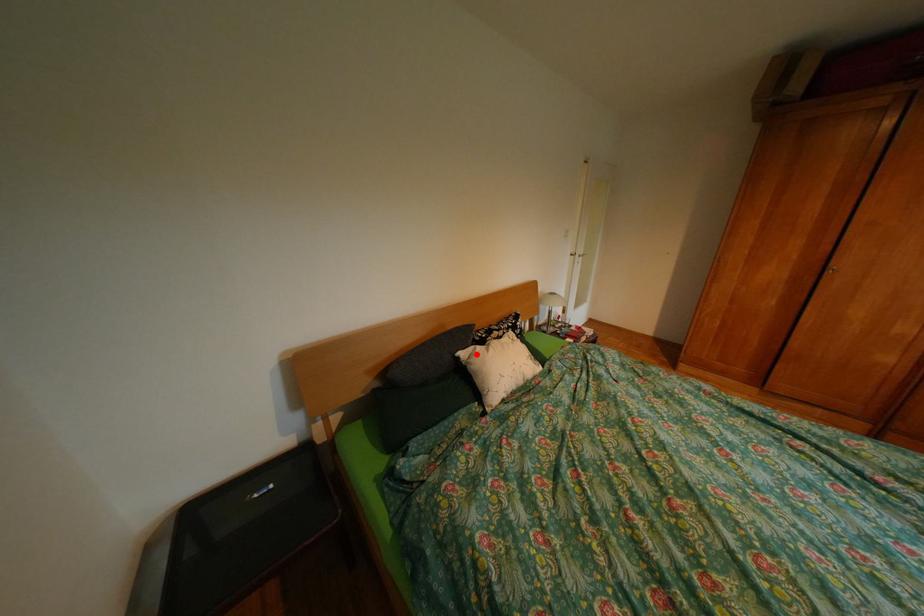
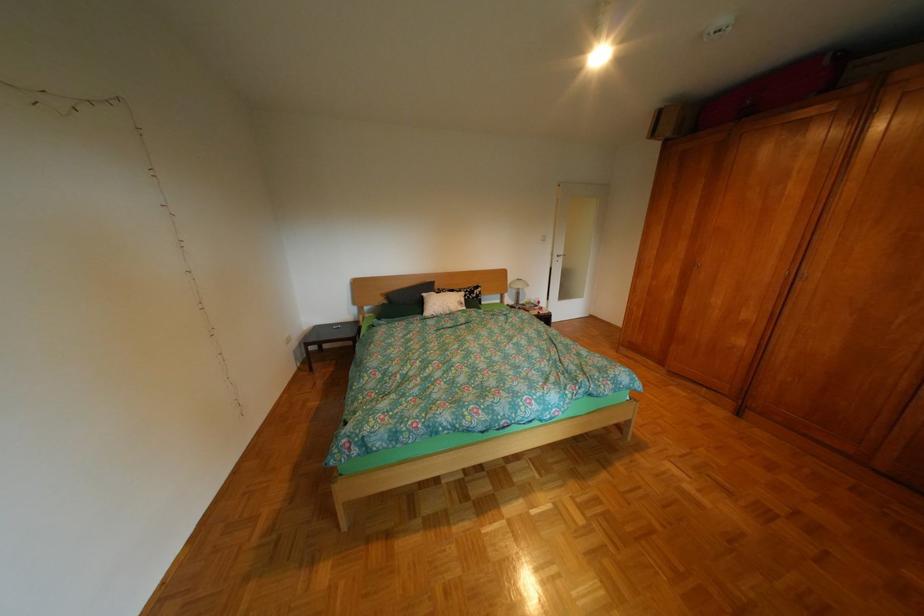
Locate, in the second image, the point that corresponds to the highlighted location in the first image.

(439, 294)